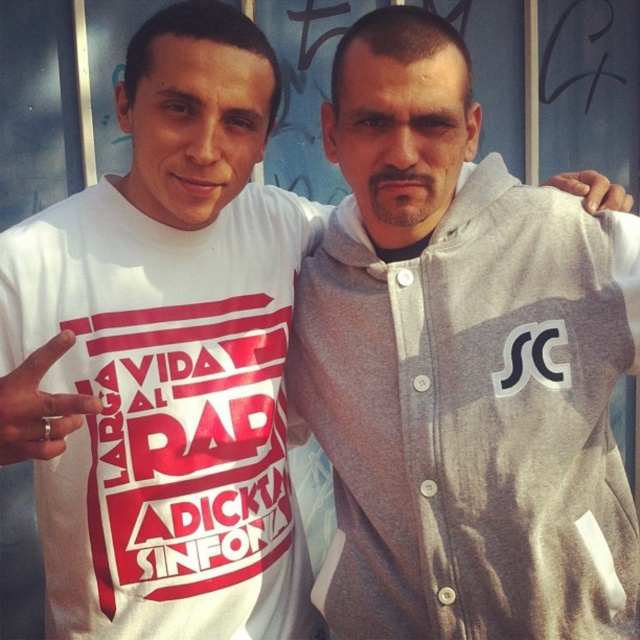
You are standing in front of the graffiti wall and want to place a small sticker on the point closer to you between the two points, point (397, 365) and point (68, 554). Which point should you choose?

Point (397, 365) is closer to you than point (68, 554), so you should choose point (397, 365).